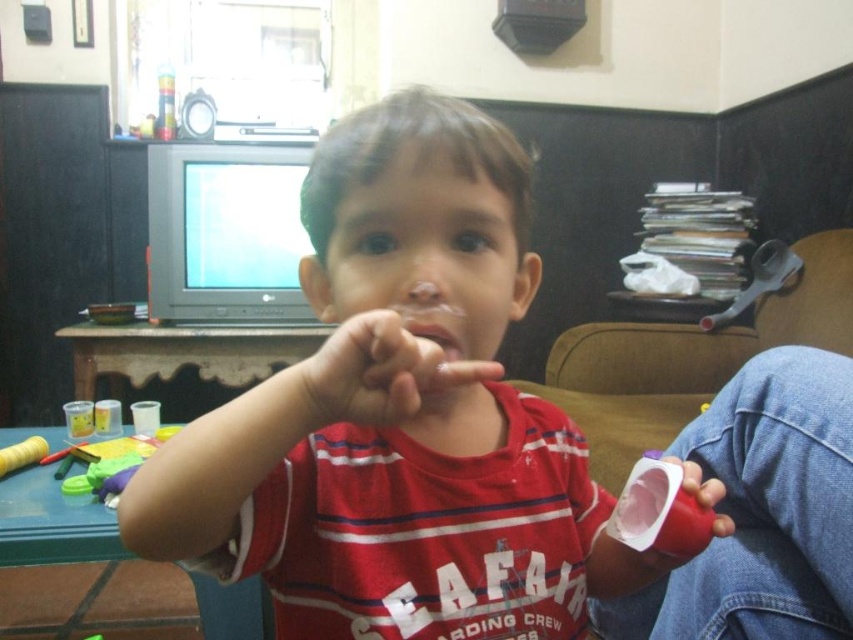
You are a delivery robot that needs to place a small package at point (x=349, y=470). The package is 10 inches in diameter. Can you safely place it there without hitting any objects?

The distance between point (x=349, y=470) and the camera is 23.35 inches. Since the package is only 10 inches in diameter, there is enough space to place it safely without hitting any objects.

The child is holding an object in their hand. Which object is wider, the red matte shirt at center or the pink matte cup at lower right?

The red matte shirt at center might be wider than pink matte cup at lower right.